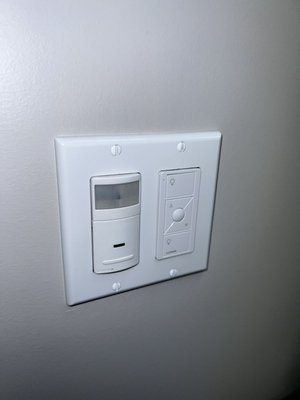
Find the location of a particular element. The image size is (300, 400). space right of outlet is located at coordinates (244, 208).